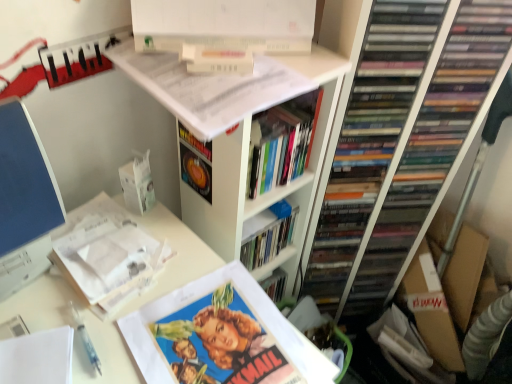
Image resolution: width=512 pixels, height=384 pixels. Describe the element at coordinates (175, 256) in the screenshot. I see `white paper at upper left` at that location.

Image resolution: width=512 pixels, height=384 pixels. What do you see at coordinates (106, 255) in the screenshot?
I see `white paper at upper left, positioned as the 2th book in bottom-to-top order` at bounding box center [106, 255].

What is the approximate height of hardcover book at center, placed as the third book when sorted from bottom to top?

It is 15.14 centimeters.

The width and height of the screenshot is (512, 384). Identify the location of white paper at upper left. (175, 256).

Which is nearer, (303, 114) or (332, 100)?

Point (303, 114) is positioned farther from the camera compared to point (332, 100).

Identify the location of the 3rd book behind the white matte bookshelf at upper center, starting your count from the anchor. (282, 142).

From the image's perspective, which is above, hardcover book at center, positioned as the second book in top-to-bottom order, or white matte bookshelf at upper center?

hardcover book at center, positioned as the second book in top-to-bottom order, from the image's perspective.

Is hardcover book at center, positioned as the second book in top-to-bottom order, inside or outside of white matte bookshelf at upper center?

hardcover book at center, positioned as the second book in top-to-bottom order, is located inside white matte bookshelf at upper center.

Is white matte book at upper center, positioned as the fourth book in bottom-to-top order, wider or thinner than white paper at upper left?

Clearly, white matte book at upper center, positioned as the fourth book in bottom-to-top order, has less width compared to white paper at upper left.

Would you say white matte book at upper center, marked as the 1th book in a top-to-bottom arrangement, is outside white paper at upper left?

Absolutely, white matte book at upper center, marked as the 1th book in a top-to-bottom arrangement, is external to white paper at upper left.

Does point (180, 52) come closer to viewer compared to point (36, 286)?

No, it is behind (36, 286).

Does white matte book at upper center, positioned as the fourth book in bottom-to-top order, have a smaller size compared to white paper at upper left?

Yes, white matte book at upper center, positioned as the fourth book in bottom-to-top order, is smaller than white paper at upper left.

Considering the positions of objects white paper at upper left and white matte book at upper center, marked as the 1th book in a top-to-bottom arrangement, in the image provided, who is more to the left, white paper at upper left or white matte book at upper center, marked as the 1th book in a top-to-bottom arrangement,?

From the viewer's perspective, white paper at upper left appears more on the left side.

Are white paper at upper left and white matte book at upper center, positioned as the fourth book in bottom-to-top order, far apart?

No, there isn't a large distance between white paper at upper left and white matte book at upper center, positioned as the fourth book in bottom-to-top order.

Looking at this image, which point is more distant from viewer, (328, 372) or (229, 56)?

The point (229, 56) is farther from the camera.

Considering the relative sizes of white paper at upper left and white matte book at upper center, positioned as the fourth book in bottom-to-top order, in the image provided, is white paper at upper left shorter than white matte book at upper center, positioned as the fourth book in bottom-to-top order,?

No, white paper at upper left is not shorter than white matte book at upper center, positioned as the fourth book in bottom-to-top order.

Relative to hardcover book at center, positioned as the second book in top-to-bottom order, is white paper at upper left, positioned as the 2th book in bottom-to-top order, in front or behind?

white paper at upper left, positioned as the 2th book in bottom-to-top order, is in front of hardcover book at center, positioned as the second book in top-to-bottom order.

Who is taller, white paper at upper left, positioned as the 2th book in bottom-to-top order, or hardcover book at center, placed as the third book when sorted from bottom to top?

Standing taller between the two is hardcover book at center, placed as the third book when sorted from bottom to top.

In terms of size, does white paper at upper left, which appears as the third book when viewed from the top, appear bigger or smaller than hardcover book at center, placed as the third book when sorted from bottom to top?

white paper at upper left, which appears as the third book when viewed from the top, is smaller than hardcover book at center, placed as the third book when sorted from bottom to top.

Consider the image. Is white paper at upper left, positioned as the 2th book in bottom-to-top order, thinner than hardcover book at center, positioned as the second book in top-to-bottom order?

Correct, the width of white paper at upper left, positioned as the 2th book in bottom-to-top order, is less than that of hardcover book at center, positioned as the second book in top-to-bottom order.

Which object is closer to the camera taking this photo, hardcover book at center, positioned as the second book in top-to-bottom order, or white paper at upper left?

white paper at upper left is more forward.

Is hardcover book at center, positioned as the second book in top-to-bottom order, not close to white paper at upper left?

No, hardcover book at center, positioned as the second book in top-to-bottom order, is not far away from white paper at upper left.

Does point (268, 173) appear closer or farther from the camera than point (110, 331)?

Point (268, 173).

How different are the orientations of hardcover book at center, placed as the third book when sorted from bottom to top, and white paper at upper left in degrees?

They differ by 4.24 degrees in their facing directions.

Is point (44, 296) closer to viewer compared to point (239, 363)?

No, (44, 296) is behind (239, 363).

From the image's perspective, which one is positioned higher, white paper at upper left or vintage paper movie poster at center, which is the first book in bottom-to-top order?

vintage paper movie poster at center, which is the first book in bottom-to-top order.

Could you tell me if white paper at upper left is facing vintage paper movie poster at center, which is the first book in bottom-to-top order?

No, white paper at upper left is not facing towards vintage paper movie poster at center, which is the first book in bottom-to-top order.

Considering the relative sizes of white paper at upper left and vintage paper movie poster at center, which is the first book in bottom-to-top order, in the image provided, is white paper at upper left bigger than vintage paper movie poster at center, which is the first book in bottom-to-top order,?

Indeed, white paper at upper left has a larger size compared to vintage paper movie poster at center, which is the first book in bottom-to-top order.

The height and width of the screenshot is (384, 512). In order to click on bookshelf in front of the white paper at upper left, positioned as the 2th book in bottom-to-top order in this screenshot , I will do `click(241, 145)`.

From the picture: Based on their sizes in the image, would you say white matte bookshelf at upper center is bigger or smaller than white paper at upper left, positioned as the 2th book in bottom-to-top order?

white matte bookshelf at upper center is bigger than white paper at upper left, positioned as the 2th book in bottom-to-top order.

Considering the positions of points (304, 63) and (99, 194), is point (304, 63) farther from camera compared to point (99, 194)?

No.

From a real-world perspective, is white matte bookshelf at upper center physically below white paper at upper left, which appears as the third book when viewed from the top?

Indeed, from a real-world perspective, white matte bookshelf at upper center is positioned beneath white paper at upper left, which appears as the third book when viewed from the top.

Find the location of a particular element. The image size is (512, 384). bookshelf below the hardcover book at center, positioned as the second book in top-to-bottom order (from a real-world perspective) is located at coordinates (241, 145).

From the white paper at upper left, count 1st book to the right and point to it. Please provide its 2D coordinates.

[(216, 59)]

Which object lies further to the anchor point white matte book at upper center, marked as the 1th book in a top-to-bottom arrangement, white matte bookshelf at upper center or white paper at upper left, positioned as the 2th book in bottom-to-top order?

white paper at upper left, positioned as the 2th book in bottom-to-top order, is positioned further to the anchor white matte book at upper center, marked as the 1th book in a top-to-bottom arrangement.

From the image, which object appears to be farther from white paper at upper left, hardcover book at center, positioned as the second book in top-to-bottom order, or white paper at upper left, positioned as the 2th book in bottom-to-top order?

Based on the image, hardcover book at center, positioned as the second book in top-to-bottom order, appears to be further to white paper at upper left.

Considering their positions, is white matte bookshelf at upper center positioned closer to hardcover book at center, positioned as the second book in top-to-bottom order, than white matte book at upper center, marked as the 1th book in a top-to-bottom arrangement?

Based on the image, white matte bookshelf at upper center appears to be nearer to hardcover book at center, positioned as the second book in top-to-bottom order.

Based on their spatial positions, is white paper at upper left, which appears as the third book when viewed from the top, or hardcover book at center, placed as the third book when sorted from bottom to top, further from white matte book at upper center, marked as the 1th book in a top-to-bottom arrangement?

The object further to white matte book at upper center, marked as the 1th book in a top-to-bottom arrangement, is white paper at upper left, which appears as the third book when viewed from the top.

Which object lies nearer to the anchor point white paper at upper left, white matte book at upper center, positioned as the fourth book in bottom-to-top order, or vintage paper movie poster at center, which is the first book in bottom-to-top order?

vintage paper movie poster at center, which is the first book in bottom-to-top order, is positioned closer to the anchor white paper at upper left.

Looking at the image, which one is located further to white matte bookshelf at upper center, white matte book at upper center, marked as the 1th book in a top-to-bottom arrangement, or vintage paper movie poster at center, which is the fourth book in top-to-bottom order?

The object further to white matte bookshelf at upper center is vintage paper movie poster at center, which is the fourth book in top-to-bottom order.

Considering their positions, is white paper at upper left, which appears as the third book when viewed from the top, positioned closer to vintage paper movie poster at center, which is the fourth book in top-to-bottom order, than hardcover book at center, placed as the third book when sorted from bottom to top?

Among the two, white paper at upper left, which appears as the third book when viewed from the top, is located nearer to vintage paper movie poster at center, which is the fourth book in top-to-bottom order.

Which object lies further to the anchor point vintage paper movie poster at center, which is the fourth book in top-to-bottom order, white paper at upper left, which appears as the third book when viewed from the top, or white paper at upper left?

white paper at upper left, which appears as the third book when viewed from the top, is further to vintage paper movie poster at center, which is the fourth book in top-to-bottom order.

Locate an element on the screen. The image size is (512, 384). book between white matte book at upper center, positioned as the fourth book in bottom-to-top order, and white matte bookshelf at upper center vertically is located at coordinates (282, 142).

The height and width of the screenshot is (384, 512). Identify the location of book between white paper at upper left, positioned as the 2th book in bottom-to-top order, and white paper at upper left, in the vertical direction. (221, 336).

Find the location of `book that lies between hardcover book at center, placed as the third book when sorted from bottom to top, and vintage paper movie poster at center, which is the fourth book in top-to-bottom order, from top to bottom`. book that lies between hardcover book at center, placed as the third book when sorted from bottom to top, and vintage paper movie poster at center, which is the fourth book in top-to-bottom order, from top to bottom is located at coordinates (106, 255).

Where is `bookshelf between white paper at upper left, which appears as the third book when viewed from the top, and vintage paper movie poster at center, which is the first book in bottom-to-top order, from left to right`? This screenshot has width=512, height=384. bookshelf between white paper at upper left, which appears as the third book when viewed from the top, and vintage paper movie poster at center, which is the first book in bottom-to-top order, from left to right is located at coordinates (241, 145).